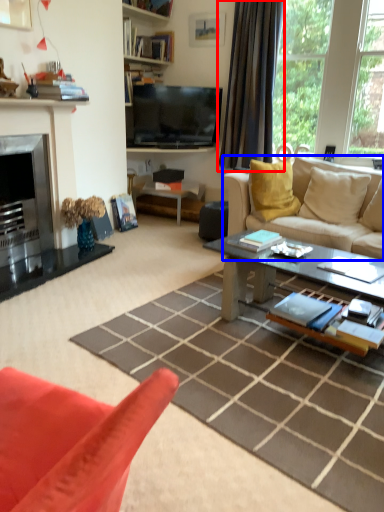
Question: Which object appears closest to the camera in this image, curtain (highlighted by a red box) or studio couch (highlighted by a blue box)?

Choices:
 (A) curtain
 (B) studio couch

Answer: (B)